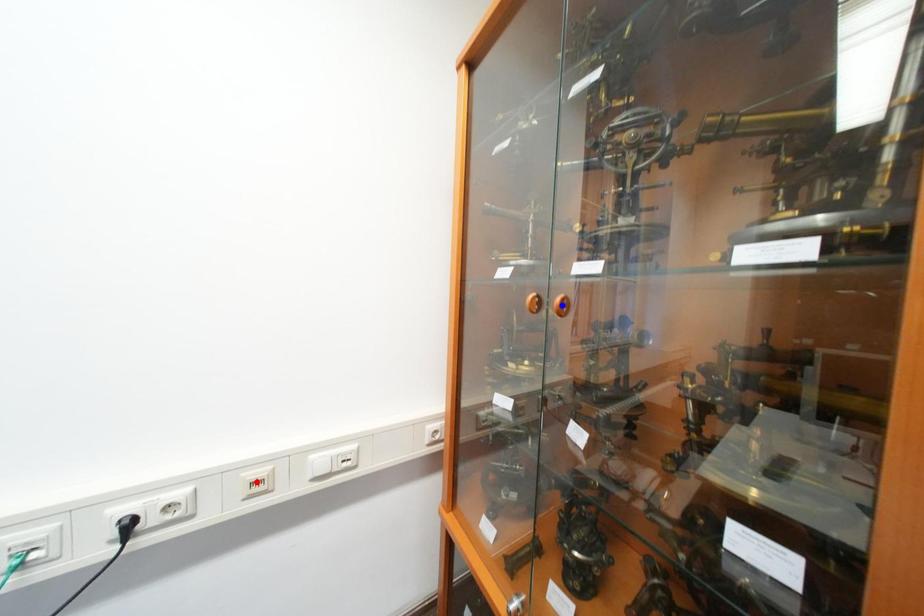
Question: Which of the two points in the image is closer to the camera?

Choices:
 (A) Blue point is closer.
 (B) Red point is closer.

Answer: (A)